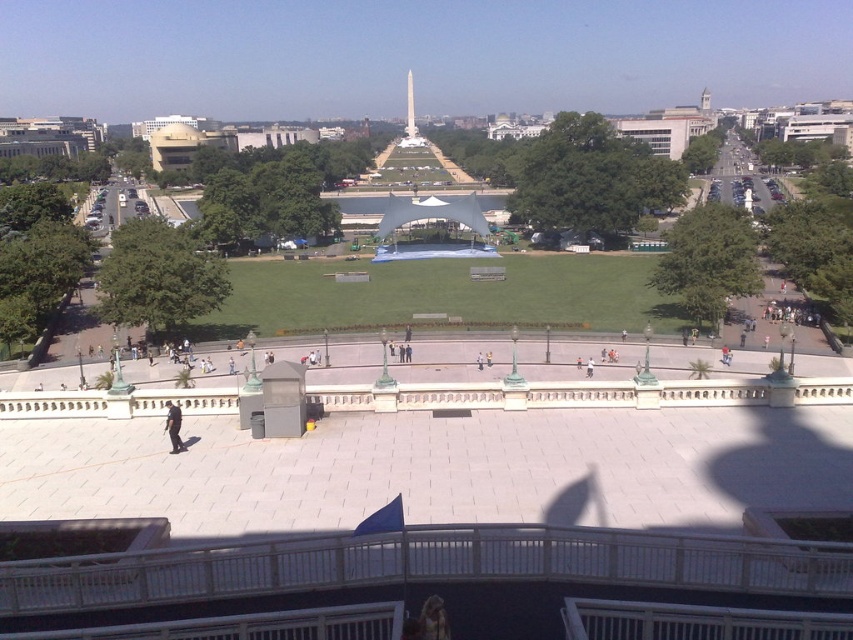
Does black uniformed officer at lower left lie in front of shiny gold monument at center?

Yes, black uniformed officer at lower left is in front of shiny gold monument at center.

Who is more forward, (178, 438) or (407, 83)?

Point (178, 438) is in front.

This screenshot has width=853, height=640. What do you see at coordinates (173, 426) in the screenshot? I see `black uniformed officer at lower left` at bounding box center [173, 426].

This screenshot has width=853, height=640. What are the coordinates of `black uniformed officer at lower left` in the screenshot? It's located at (173, 426).